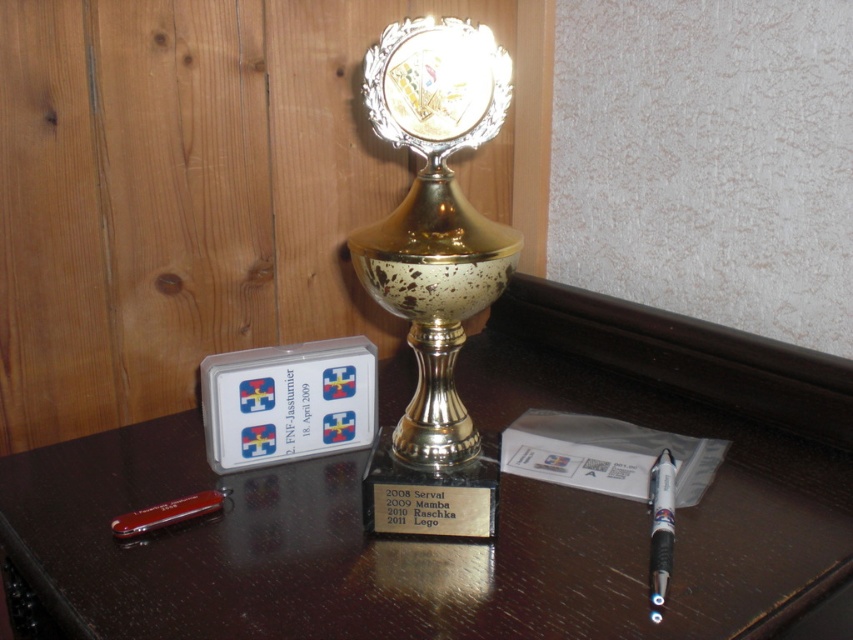
Question: Considering the relative positions of shiny dark wood table at center and black plastic pen at lower right in the image provided, where is shiny dark wood table at center located with respect to black plastic pen at lower right?

Choices:
 (A) right
 (B) left

Answer: (B)

Question: Which of the following is the farthest from the observer?

Choices:
 (A) gold polished trophy at center
 (B) shiny dark wood table at center
 (C) red plastic pen at lower left

Answer: (C)

Question: Is black plastic pen at lower right to the left of red plastic pen at lower left from the viewer's perspective?

Choices:
 (A) no
 (B) yes

Answer: (A)

Question: Which object is farther from the camera taking this photo?

Choices:
 (A) gold polished trophy at center
 (B) black plastic pen at lower right
 (C) shiny dark wood table at center

Answer: (A)

Question: Which is nearer to the red plastic pen at lower left?

Choices:
 (A) black plastic pen at lower right
 (B) gold polished trophy at center
 (C) shiny dark wood table at center

Answer: (C)

Question: Observing the image, what is the correct spatial positioning of black plastic pen at lower right in reference to red plastic pen at lower left?

Choices:
 (A) below
 (B) above

Answer: (A)